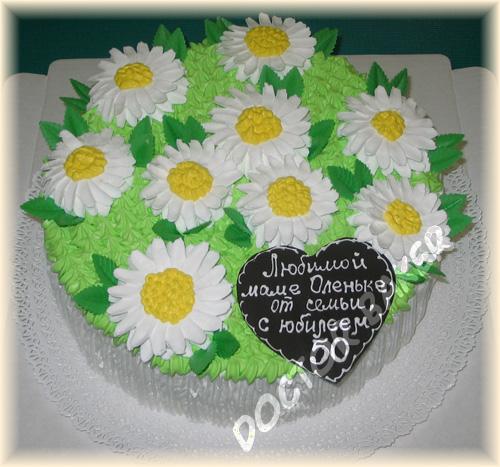
You are a GUI agent. You are given a task and a screenshot of the screen. Output one action in this format:
    pyautogui.click(x=<x>, y=<y>)
    Task: Click on the doily
    The height and width of the screenshot is (467, 500).
    Given the screenshot: What is the action you would take?
    pyautogui.click(x=400, y=414)